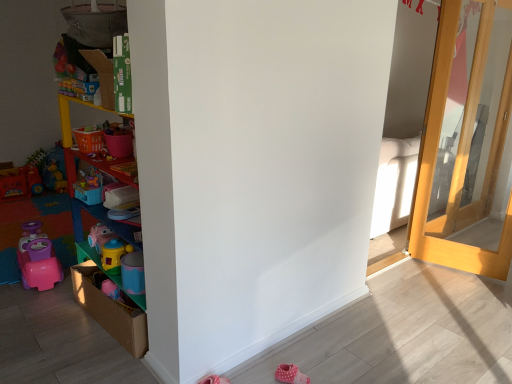
You are a GUI agent. You are given a task and a screenshot of the screen. Output one action in this format:
    pyautogui.click(x=<x>, y=<y>)
    Task: Click on the light wood door at right
    The height and width of the screenshot is (384, 512).
    Given the screenshot: What is the action you would take?
    pyautogui.click(x=466, y=142)

What are the coordinates of `pink fabric shoe at lower right` in the screenshot? It's located at pos(290,374).

I want to click on light wood door at right, so click(x=466, y=142).

Is pink fabric shoe at lower right located outside multicolored plastic shelves at left?

Indeed, pink fabric shoe at lower right is completely outside multicolored plastic shelves at left.

Is the surface of pink fabric shoe at lower right in direct contact with multicolored plastic shelves at left?

There is a gap between pink fabric shoe at lower right and multicolored plastic shelves at left.

From a real-world perspective, which is physically above, pink fabric shoe at lower right or multicolored plastic shelves at left?

multicolored plastic shelves at left.

Which object is positioned more to the left, pink fabric shoe at lower right or multicolored plastic shelves at left?

From the viewer's perspective, multicolored plastic shelves at left appears more on the left side.

Which is in front, light wood door at right or multicolored plastic shelves at left?

multicolored plastic shelves at left.

Considering the relative sizes of light wood door at right and multicolored plastic shelves at left in the image provided, is light wood door at right smaller than multicolored plastic shelves at left?

Actually, light wood door at right might be larger than multicolored plastic shelves at left.

From a real-world perspective, is light wood door at right over multicolored plastic shelves at left?

Yes, from a real-world perspective, light wood door at right is on top of multicolored plastic shelves at left.

Does light wood door at right turn towards multicolored plastic shelves at left?

No.

How many degrees apart are the facing directions of multicolored plastic shelves at left and pink fabric shoe at lower right?

There is a 126-degree angle between the facing directions of multicolored plastic shelves at left and pink fabric shoe at lower right.

Considering the sizes of objects multicolored plastic shelves at left and pink fabric shoe at lower right in the image provided, who is thinner, multicolored plastic shelves at left or pink fabric shoe at lower right?

multicolored plastic shelves at left is thinner.

Looking at this image, is multicolored plastic shelves at left not within pink fabric shoe at lower right?

multicolored plastic shelves at left lies outside pink fabric shoe at lower right's area.

Would you say pink fabric shoe at lower right is part of light wood door at right's contents?

No.

Consider the image. Can you tell me how much light wood door at right and pink fabric shoe at lower right differ in facing direction?

light wood door at right and pink fabric shoe at lower right are facing 109 degrees away from each other.

Who is shorter, light wood door at right or pink fabric shoe at lower right?

pink fabric shoe at lower right is shorter.

How much distance is there between pink fabric shoe at lower right and light wood door at right?

pink fabric shoe at lower right and light wood door at right are 8.13 feet apart from each other.

Which is behind, point (275, 375) or point (470, 173)?

Positioned behind is point (470, 173).

From a real-world perspective, which object rests below the other?

pink fabric shoe at lower right.

Is point (92, 159) less distant than point (500, 86)?

Yes, it is in front of point (500, 86).

Is the position of multicolored plastic shelves at left less distant than that of light wood door at right?

Yes, multicolored plastic shelves at left is closer to the camera.

Can you confirm if multicolored plastic shelves at left is shorter than light wood door at right?

Yes.

The height and width of the screenshot is (384, 512). I want to click on shelf that appears in front of the pink fabric shoe at lower right, so click(104, 224).

Identify the location of shelf on the left of light wood door at right. (104, 224).

Looking at the image, which one is located further to multicolored plastic shelves at left, pink fabric shoe at lower right or light wood door at right?

The object further to multicolored plastic shelves at left is light wood door at right.

Based on their spatial positions, is multicolored plastic shelves at left or light wood door at right closer to pink fabric shoe at lower right?

Based on the image, multicolored plastic shelves at left appears to be nearer to pink fabric shoe at lower right.

Looking at this image, looking at the image, which one is located further to multicolored plastic shelves at left, light wood door at right or pink fabric shoe at lower right?

Among the two, light wood door at right is located further to multicolored plastic shelves at left.

When comparing their distances from light wood door at right, does multicolored plastic shelves at left or pink fabric shoe at lower right seem closer?

pink fabric shoe at lower right lies closer to light wood door at right than the other object.

Estimate the real-world distances between objects in this image. Which object is closer to light wood door at right, pink fabric shoe at lower right or multicolored plastic shelves at left?

pink fabric shoe at lower right is closer to light wood door at right.

Considering their positions, is light wood door at right positioned further to pink fabric shoe at lower right than multicolored plastic shelves at left?

Based on the image, light wood door at right appears to be further to pink fabric shoe at lower right.

The height and width of the screenshot is (384, 512). What are the coordinates of `shoe located between multicolored plastic shelves at left and light wood door at right in the left-right direction` in the screenshot? It's located at (290, 374).